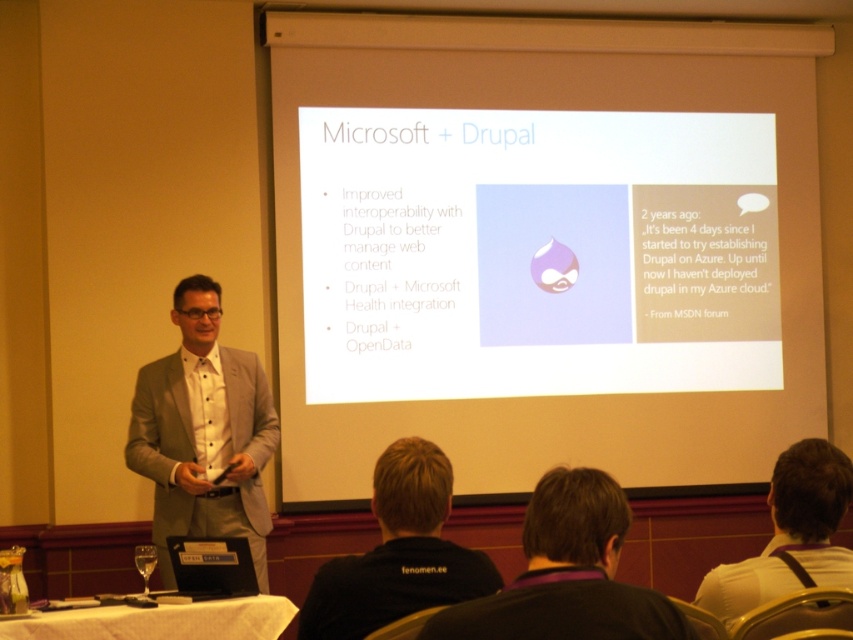
You are a presenter standing in front of the screen. You want to point to the bullet point that says Drupal and Microsoft. Is the point at coordinate [567,573] on the screen?

Answer: The point at coordinate [567,573] is on dark brown hair at center, not on the screen. Therefore, it is not pointing to the bullet point on the screen.

You are an attendee at the presentation and you notice the speaker has dark brown hair at center and a black fabric shirt at lower center. Which of these two features is positioned to the right side of the speaker?

The dark brown hair at center is positioned to the right of the black fabric shirt at lower center, so the dark brown hair at center is on the right side of the speaker.

Consider the image. You are an attendee at the presentation and you see the black fabric shirt at lower center and the white fabric shirt at upper center. Which shirt is more to the left?

The black fabric shirt at lower center is more to the left side than the white fabric shirt at upper center.